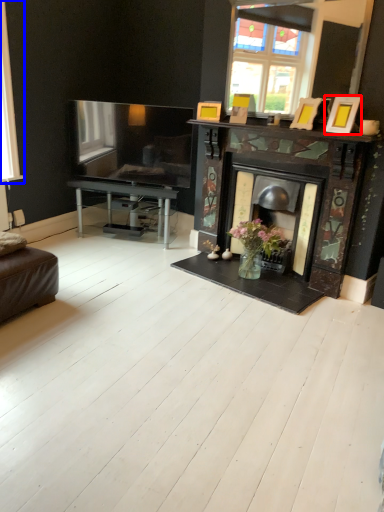
Question: Which object is closer to the camera taking this photo, picture frame (highlighted by a red box) or window (highlighted by a blue box)?

Choices:
 (A) picture frame
 (B) window

Answer: (A)